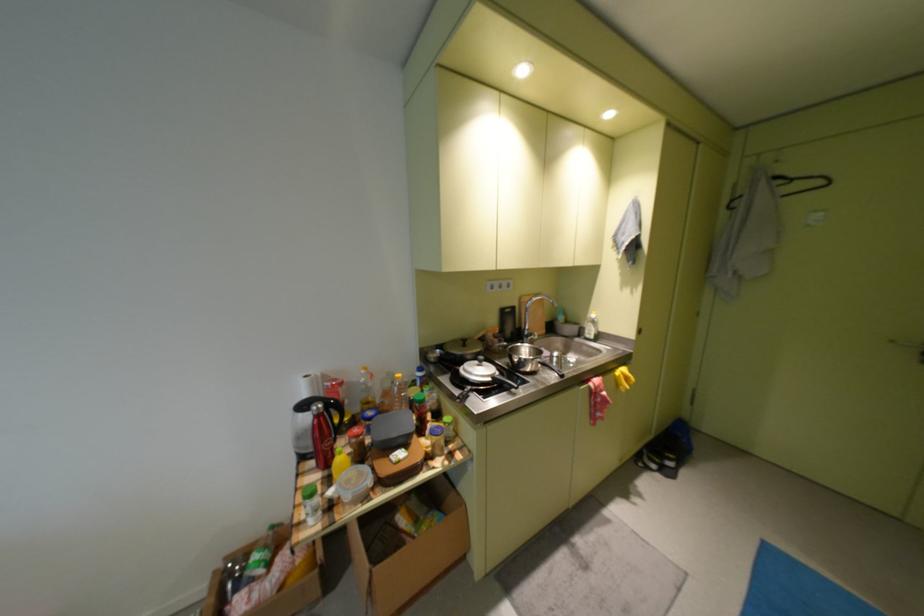
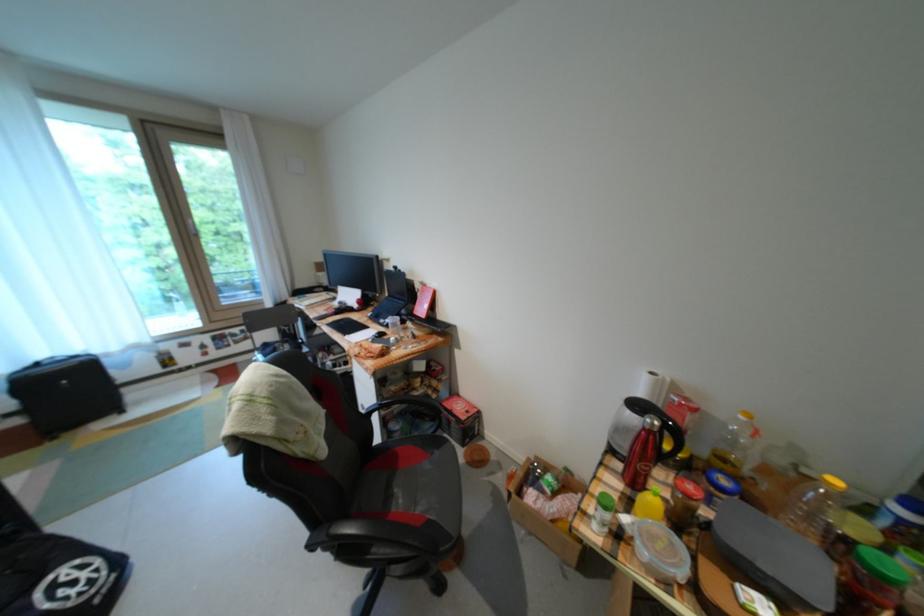
Where in the second image is the point corresponding to pixel 407 390 from the first image?

(821, 495)